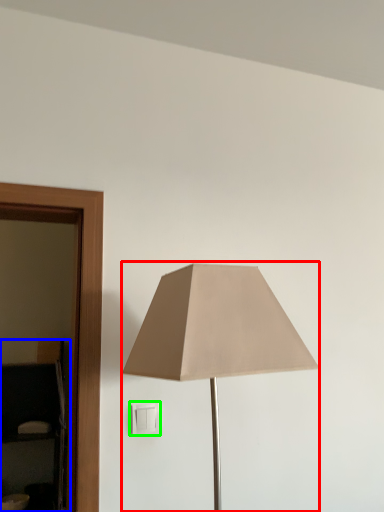
Question: Which object is positioned closest to lamp (highlighted by a red box)? Select from dresser (highlighted by a blue box) and light switch (highlighted by a green box).

Choices:
 (A) dresser
 (B) light switch

Answer: (B)